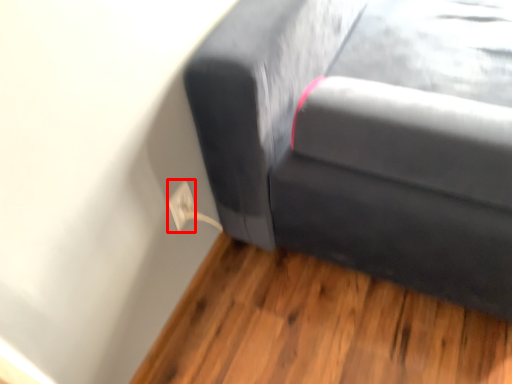
Question: From the image's perspective, considering the relative positions of electric outlet (annotated by the red box) and studio couch in the image provided, where is electric outlet (annotated by the red box) located with respect to the staircase?

Choices:
 (A) below
 (B) above

Answer: (B)